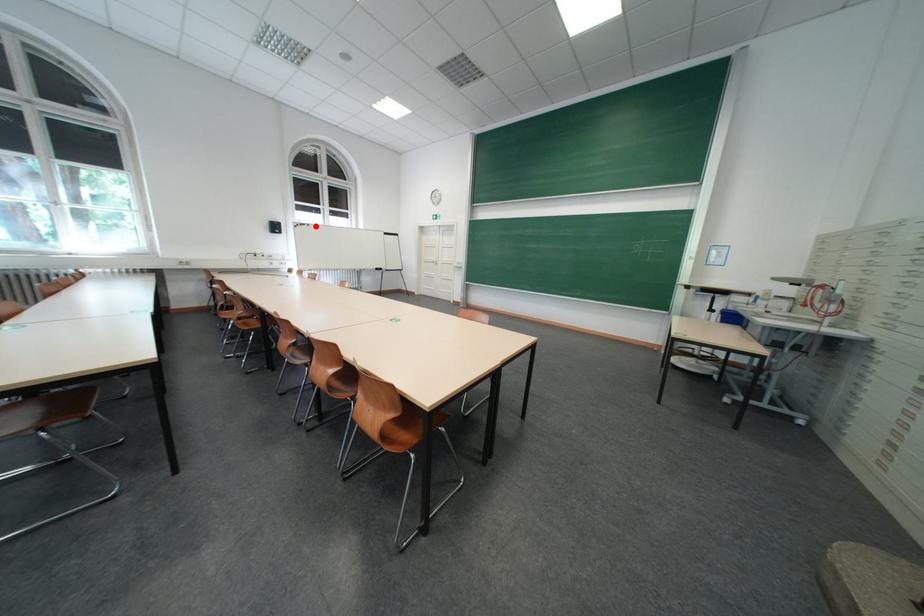
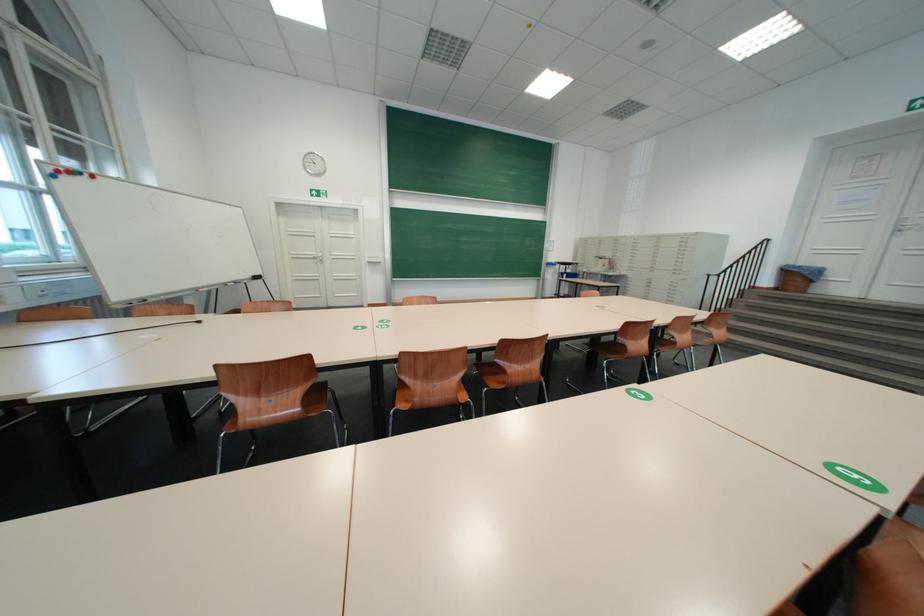
Question: A red point is marked in image1. In image2, is the corresponding 3D point closer to the camera or farther? Reply with the corresponding letter.

Choices:
 (A) The corresponding 3D point is closer.
 (B) The corresponding 3D point is farther.

Answer: (B)